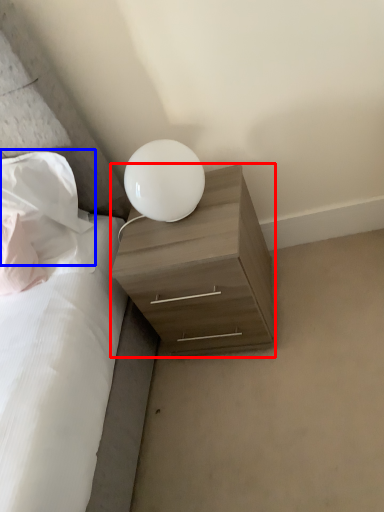
Question: Which of the following is the closest to the observer, nightstand (highlighted by a red box) or pillow (highlighted by a blue box)?

Choices:
 (A) nightstand
 (B) pillow

Answer: (A)